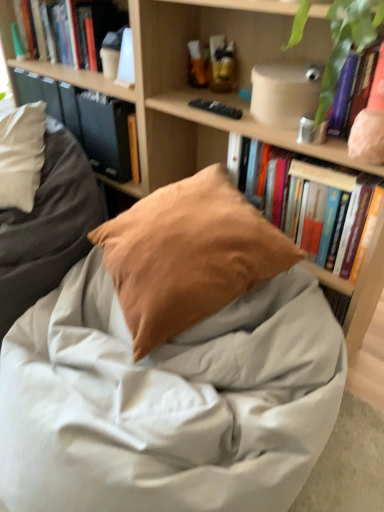
Question: From the image's perspective, would you say hardcover book at upper left, arranged as the 1th book when viewed from the top, is positioned over hardcover book at upper right, placed as the 1th book when sorted from front to back?

Choices:
 (A) no
 (B) yes

Answer: (B)

Question: Does hardcover book at upper left, positioned as the 2th book in front-to-back order, have a lesser height compared to hardcover book at upper right, placed as the 1th book when sorted from front to back?

Choices:
 (A) yes
 (B) no

Answer: (A)

Question: Is hardcover book at upper right, which is the first book from bottom to top, inside hardcover book at upper left, arranged as the 1th book when viewed from the top?

Choices:
 (A) yes
 (B) no

Answer: (B)

Question: Are hardcover book at upper left, positioned as the 2th book in front-to-back order, and hardcover book at upper right, placed as the second book when sorted from back to front, far apart?

Choices:
 (A) no
 (B) yes

Answer: (A)

Question: Is hardcover book at upper left, acting as the 2th book starting from the right, facing towards hardcover book at upper right, positioned as the second book in top-to-bottom order?

Choices:
 (A) yes
 (B) no

Answer: (B)

Question: In the image, is hardcover book at upper left, acting as the 2th book starting from the right, on the left side or the right side of green leafy plant at upper right?

Choices:
 (A) left
 (B) right

Answer: (A)

Question: Which is correct: hardcover book at upper left, arranged as the 1th book when viewed from the top, is inside green leafy plant at upper right, or outside of it?

Choices:
 (A) outside
 (B) inside

Answer: (A)

Question: From the image's perspective, relative to green leafy plant at upper right, is hardcover book at upper left, arranged as the 1th book when viewed from the top, above or below?

Choices:
 (A) below
 (B) above

Answer: (B)

Question: In terms of width, does hardcover book at upper left, placed as the 1th book when sorted from left to right, look wider or thinner when compared to green leafy plant at upper right?

Choices:
 (A) wide
 (B) thin

Answer: (B)

Question: Looking at the image, does hardcover book at upper left seem bigger or smaller compared to matte brown pillow at center?

Choices:
 (A) big
 (B) small

Answer: (B)

Question: From the image's perspective, is hardcover book at upper left located above or below matte brown pillow at center?

Choices:
 (A) below
 (B) above

Answer: (B)

Question: Is point 82,138 positioned closer to the camera than point 64,178?

Choices:
 (A) closer
 (B) farther

Answer: (B)

Question: Considering the positions of hardcover book at upper left and matte brown pillow at center in the image, is hardcover book at upper left taller or shorter than matte brown pillow at center?

Choices:
 (A) tall
 (B) short

Answer: (B)

Question: From a real-world perspective, is hardcover book at upper left physically located above or below matte beige container at upper right?

Choices:
 (A) below
 (B) above

Answer: (A)

Question: In the image, is hardcover book at upper left positioned in front of or behind matte beige container at upper right?

Choices:
 (A) front
 (B) behind

Answer: (B)